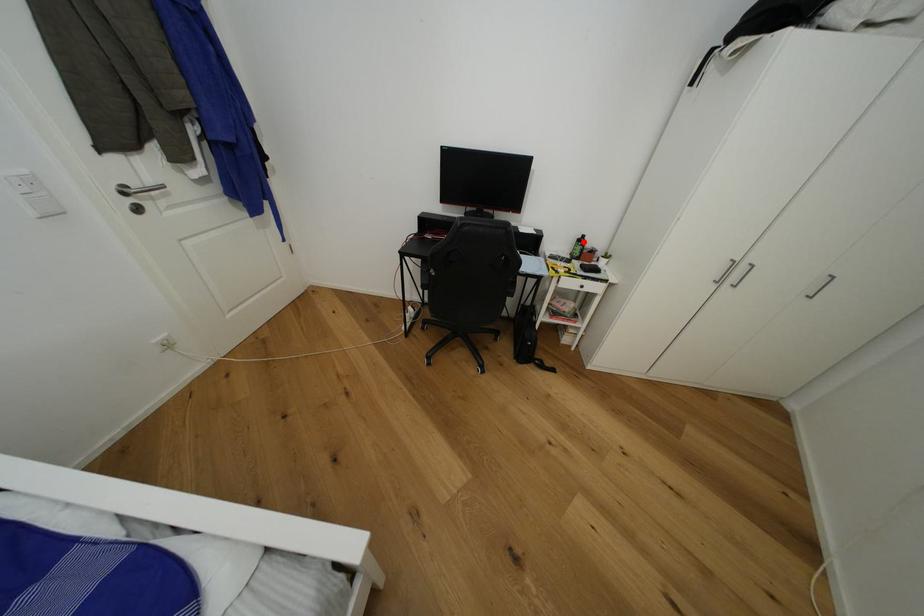
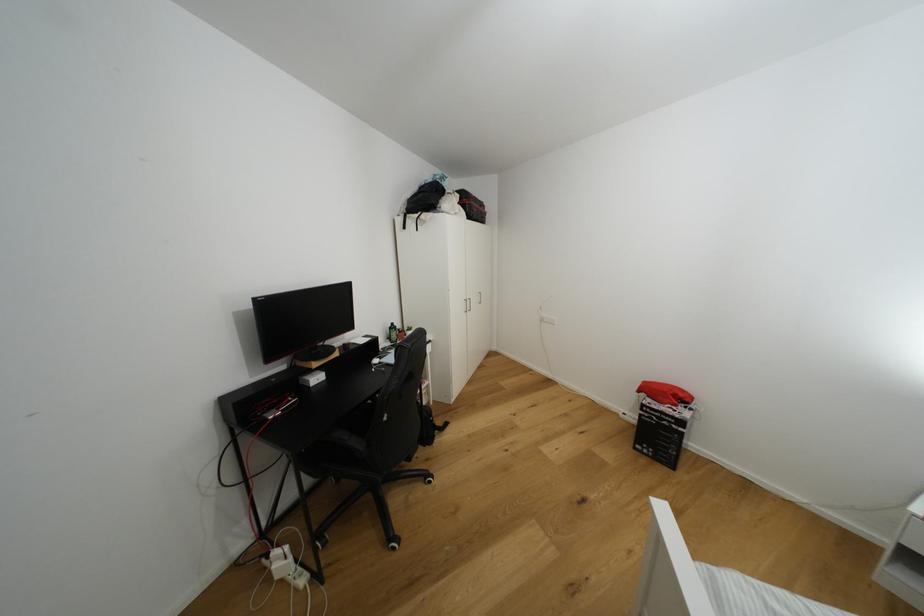
The point at the highlighted location is marked in the first image. Where is the corresponding point in the second image?

(395, 330)